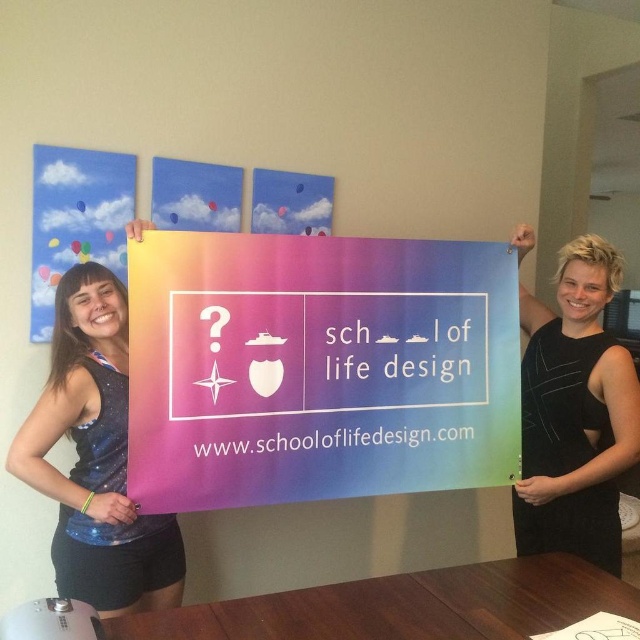
Between glossy fabric tank top at left and black matte dress at right, which one is positioned higher?

black matte dress at right

Between point (115, 474) and point (605, 490), which one is positioned in front?

Point (115, 474)

Does point (67, 412) come behind point (573, 518)?

That is False.

Find the location of a particular element. glossy fabric tank top at left is located at coordinates coord(96,458).

Does rainbow gradient poster at center have a larger size compared to glossy fabric tank top at left?

Correct, rainbow gradient poster at center is larger in size than glossy fabric tank top at left.

Is rainbow gradient poster at center taller than glossy fabric tank top at left?

In fact, rainbow gradient poster at center may be shorter than glossy fabric tank top at left.

You are a GUI agent. You are given a task and a screenshot of the screen. Output one action in this format:
    pyautogui.click(x=<x>, y=<y>)
    Task: Click on the rainbow gradient poster at center
    
    Given the screenshot: What is the action you would take?
    pyautogui.click(x=317, y=369)

Is rainbow gradient poster at center taller than black matte dress at right?

In fact, rainbow gradient poster at center may be shorter than black matte dress at right.

Is rainbow gradient poster at center to the right of black matte dress at right from the viewer's perspective?

Incorrect, rainbow gradient poster at center is not on the right side of black matte dress at right.

Locate an element on the screen. rainbow gradient poster at center is located at coordinates (317, 369).